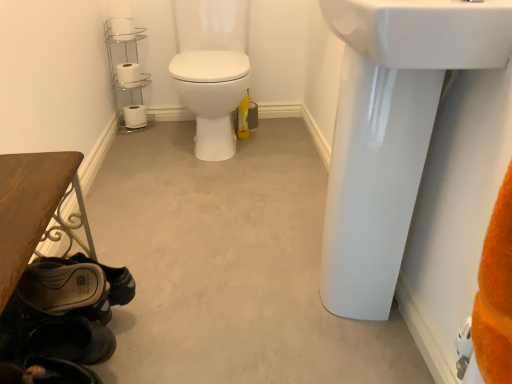
Question: Is white glossy sink at upper right, the first sink in the bottom-to-top sequence, touching chrome/metallic toilet paper holder at upper left?

Choices:
 (A) yes
 (B) no

Answer: (B)

Question: Can you confirm if white glossy sink at upper right, positioned as the second sink in top-to-bottom order, is positioned to the right of chrome/metallic toilet paper holder at upper left?

Choices:
 (A) yes
 (B) no

Answer: (A)

Question: From a real-world perspective, is white glossy sink at upper right, positioned as the second sink in top-to-bottom order, physically below chrome/metallic toilet paper holder at upper left?

Choices:
 (A) no
 (B) yes

Answer: (A)

Question: Can you confirm if white glossy sink at upper right, the first sink in the bottom-to-top sequence, is wider than chrome/metallic toilet paper holder at upper left?

Choices:
 (A) yes
 (B) no

Answer: (B)

Question: Would you say white glossy sink at upper right, the first sink in the bottom-to-top sequence, is outside chrome/metallic toilet paper holder at upper left?

Choices:
 (A) no
 (B) yes

Answer: (B)

Question: Can you confirm if white glossy sink at upper right, the first sink in the bottom-to-top sequence, is smaller than chrome/metallic toilet paper holder at upper left?

Choices:
 (A) no
 (B) yes

Answer: (A)

Question: Does white matte toilet paper at lower left, which is counted as the third toilet paper, starting from the front, come behind chrome/metallic toilet paper holder at upper left?

Choices:
 (A) no
 (B) yes

Answer: (B)

Question: From a real-world perspective, is white matte toilet paper at lower left, which is the 3th toilet paper from top to bottom, positioned under chrome/metallic toilet paper holder at upper left based on gravity?

Choices:
 (A) no
 (B) yes

Answer: (B)

Question: Is white matte toilet paper at lower left, which is the 3th toilet paper from top to bottom, next to chrome/metallic toilet paper holder at upper left?

Choices:
 (A) no
 (B) yes

Answer: (A)

Question: Is white matte toilet paper at lower left, which is counted as the third toilet paper, starting from the front, to the left of chrome/metallic toilet paper holder at upper left from the viewer's perspective?

Choices:
 (A) no
 (B) yes

Answer: (B)

Question: Is chrome/metallic toilet paper holder at upper left surrounded by white matte toilet paper at lower left, arranged as the 1th toilet paper when viewed from the back?

Choices:
 (A) no
 (B) yes

Answer: (A)

Question: Is white matte toilet paper at lower left, which is the 3th toilet paper from top to bottom, not close to chrome/metallic toilet paper holder at upper left?

Choices:
 (A) yes
 (B) no

Answer: (B)

Question: Is dark brown leather shoe at lower left, the second shoe when ordered from back to front, taller than white matte toilet paper at upper left, positioned as the second toilet paper in front-to-back order?

Choices:
 (A) yes
 (B) no

Answer: (A)